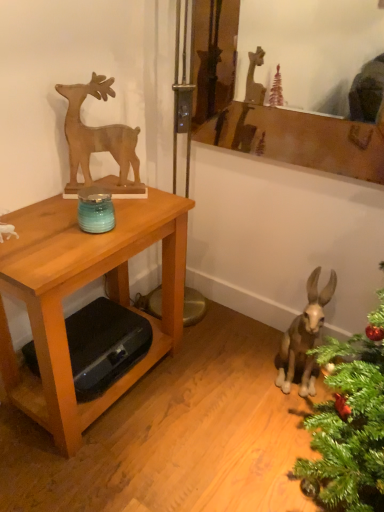
Question: From a real-world perspective, is wooden mirror at upper center beneath wooden table at left?

Choices:
 (A) yes
 (B) no

Answer: (B)

Question: From a real-world perspective, is wooden mirror at upper center on wooden table at left?

Choices:
 (A) no
 (B) yes

Answer: (B)

Question: Is wooden mirror at upper center located outside wooden table at left?

Choices:
 (A) yes
 (B) no

Answer: (A)

Question: Is wooden mirror at upper center smaller than wooden table at left?

Choices:
 (A) no
 (B) yes

Answer: (B)

Question: From the image's perspective, is wooden mirror at upper center on top of wooden table at left?

Choices:
 (A) no
 (B) yes

Answer: (B)

Question: Relative to brown matte donkey at lower right, is wooden mirror at upper center in front or behind?

Choices:
 (A) front
 (B) behind

Answer: (A)

Question: Is wooden mirror at upper center bigger or smaller than brown matte donkey at lower right?

Choices:
 (A) small
 (B) big

Answer: (A)

Question: Visually, is wooden mirror at upper center positioned to the left or to the right of brown matte donkey at lower right?

Choices:
 (A) left
 (B) right

Answer: (A)

Question: In terms of height, does wooden mirror at upper center look taller or shorter compared to brown matte donkey at lower right?

Choices:
 (A) tall
 (B) short

Answer: (B)

Question: Is point (59, 216) positioned closer to the camera than point (340, 104)?

Choices:
 (A) farther
 (B) closer

Answer: (B)

Question: Would you say wooden table at left is to the left or to the right of wooden mirror at upper center in the picture?

Choices:
 (A) right
 (B) left

Answer: (B)

Question: In terms of size, does wooden table at left appear bigger or smaller than wooden mirror at upper center?

Choices:
 (A) small
 (B) big

Answer: (B)

Question: Looking at their shapes, would you say wooden table at left is wider or thinner than wooden mirror at upper center?

Choices:
 (A) wide
 (B) thin

Answer: (A)

Question: Considering their positions, is wooden table at left located in front of or behind wooden deer at upper left?

Choices:
 (A) front
 (B) behind

Answer: (A)

Question: Looking at their shapes, would you say wooden table at left is wider or thinner than wooden deer at upper left?

Choices:
 (A) wide
 (B) thin

Answer: (A)